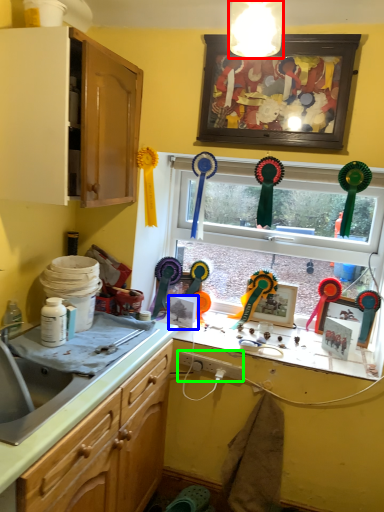
Question: Estimate the real-world distances between objects in this image. Which object is farther from light fixture (highlighted by a red box), picture frame (highlighted by a blue box) or plug (highlighted by a green box)?

Choices:
 (A) picture frame
 (B) plug

Answer: (A)